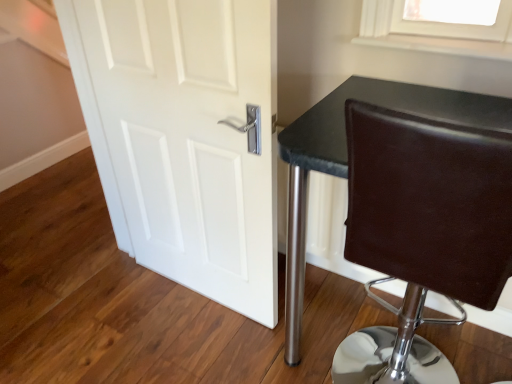
Question: Considering their positions, is brown leather chair at right located in front of or behind white matte door at center?

Choices:
 (A) front
 (B) behind

Answer: (A)

Question: In terms of height, does brown leather chair at right look taller or shorter compared to white matte door at center?

Choices:
 (A) tall
 (B) short

Answer: (B)

Question: Would you say brown leather chair at right is inside or outside white matte door at center?

Choices:
 (A) outside
 (B) inside

Answer: (A)

Question: Is point (88, 34) closer or farther from the camera than point (453, 291)?

Choices:
 (A) closer
 (B) farther

Answer: (B)

Question: In terms of width, does white matte door at center look wider or thinner when compared to brown leather chair at right?

Choices:
 (A) thin
 (B) wide

Answer: (A)

Question: From a real-world perspective, is white matte door at center above or below brown leather chair at right?

Choices:
 (A) above
 (B) below

Answer: (A)

Question: From the image's perspective, relative to brown leather chair at right, is white matte door at center above or below?

Choices:
 (A) above
 (B) below

Answer: (A)